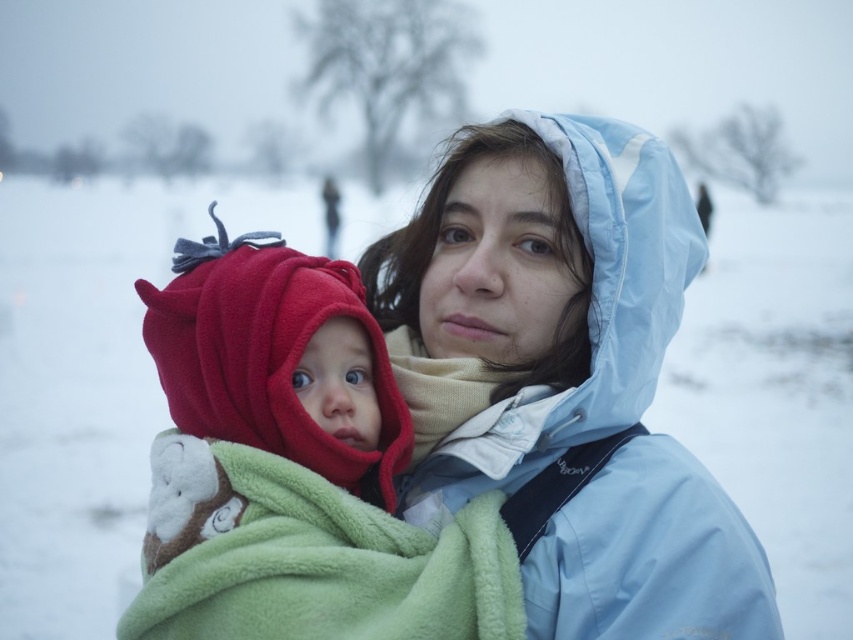
You are standing at point (x=341, y=576) and want to walk towards point (x=271, y=189). Is the point you want to reach in front of or behind you?

The point (x=271, y=189) is behind point (x=341, y=576), so the point you want to reach is behind you.

Based on the photo, you are a photographer trying to capture a clear shot of the child in the green blanket and the adult in the light blue jacket. The camera you are using has a limited depth of field. Which object should you focus on to ensure both the child and the adult are in focus? Please choose between the white fluffy snow at center and the fuzzy fleece hat at left.

The white fluffy snow at center is much taller than the fuzzy fleece hat at left. To ensure both the child and the adult are in focus, you should focus on the white fluffy snow at center because it is farther away, allowing the depth of field to cover both subjects effectively.

You are a photographer trying to capture the perfect shot of the scene. You want to place your camera exactly at the center of the white fluffy snow at center. According to the coordinates provided, where should you position your camera?

The white fluffy snow at center is located at coordinates point [91,378], so you should position your camera at that exact point to capture it perfectly.